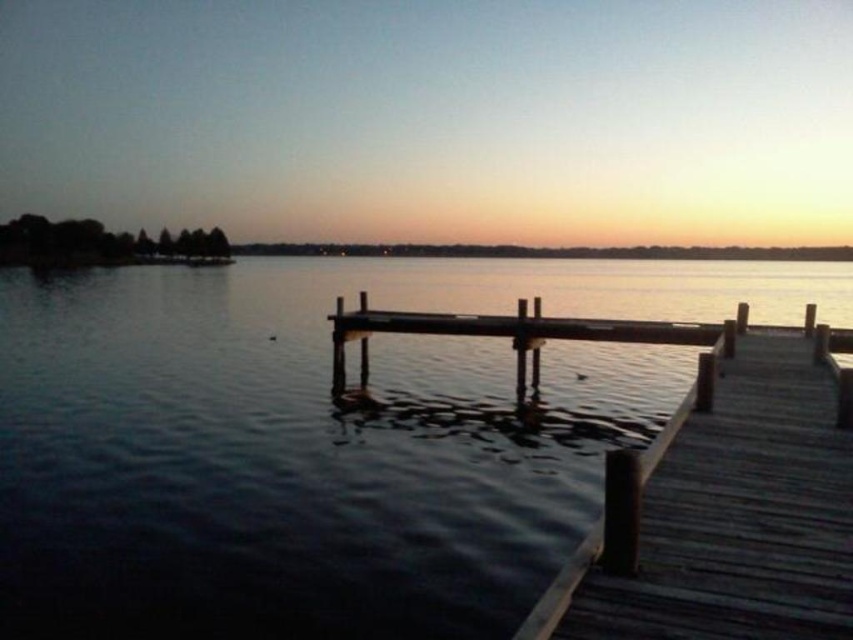
Question: Can you confirm if smooth water at center is wider than wooden dock at center?

Choices:
 (A) no
 (B) yes

Answer: (B)

Question: From the image, what is the correct spatial relationship of smooth water at center in relation to wooden dock at center?

Choices:
 (A) right
 (B) left

Answer: (B)

Question: Can you confirm if smooth water at center is smaller than wooden dock at center?

Choices:
 (A) yes
 (B) no

Answer: (B)

Question: Among these points, which one is farthest from the camera?

Choices:
 (A) (x=654, y=401)
 (B) (x=815, y=440)

Answer: (A)

Question: Among these objects, which one is farthest from the camera?

Choices:
 (A) smooth water at center
 (B) wooden dock at center

Answer: (A)